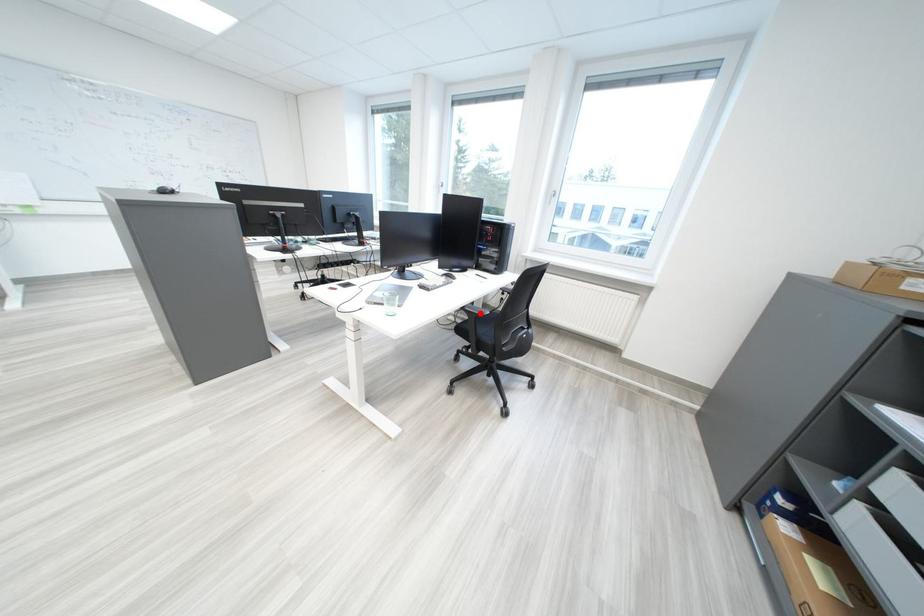
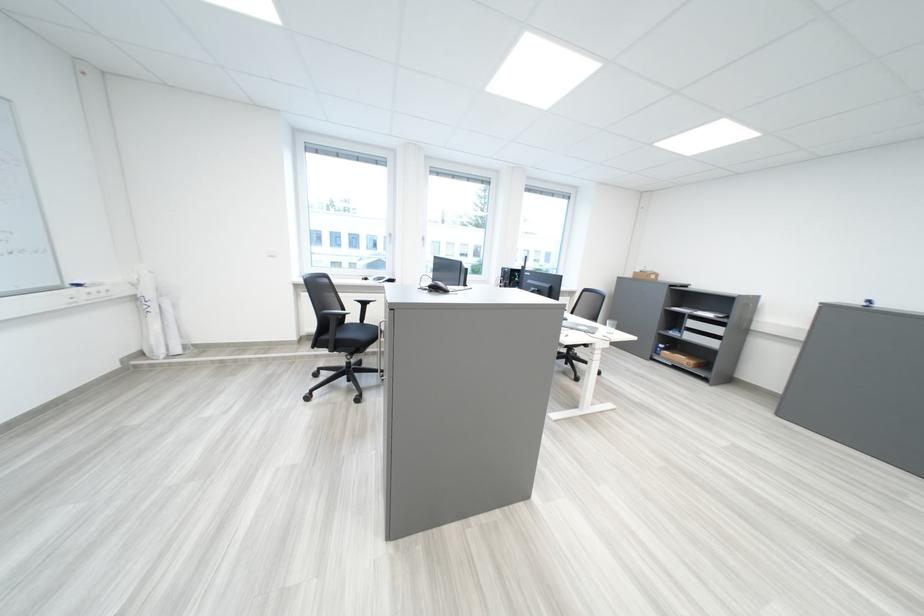
Question: I am providing you with two images of the same scene from different viewpoints. A red point is marked on the first image. Is the red point's position out of view in image 2?

Choices:
 (A) Yes
 (B) No

Answer: (A)